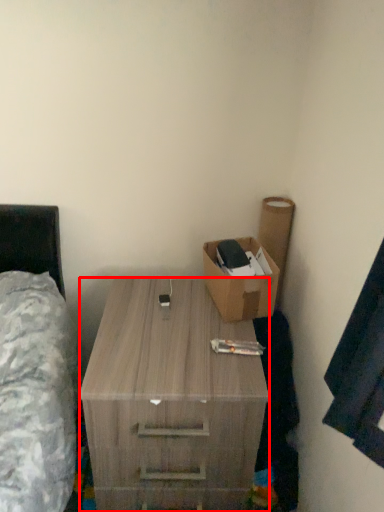
Question: From the image's perspective, where is desk (annotated by the red box) located relative to box?

Choices:
 (A) above
 (B) below

Answer: (B)